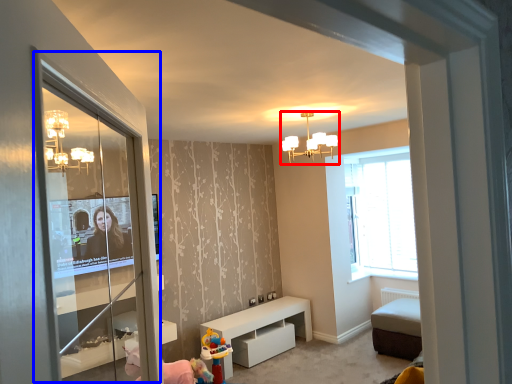
Question: Which of the following is the closest to the observer, light fixture (highlighted by a red box) or screen door (highlighted by a blue box)?

Choices:
 (A) light fixture
 (B) screen door

Answer: (B)